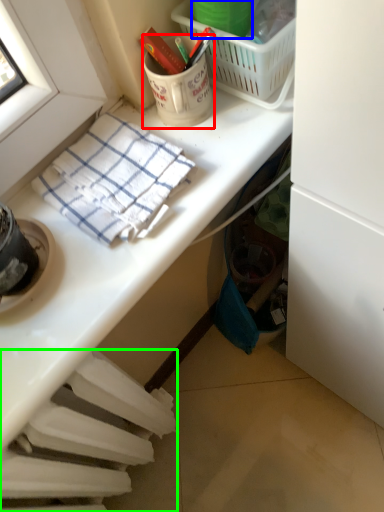
Question: Considering the real-world distances, which object is farthest from coffee cup (highlighted by a red box)? bucket (highlighted by a blue box) or radiator (highlighted by a green box)?

Choices:
 (A) bucket
 (B) radiator

Answer: (B)